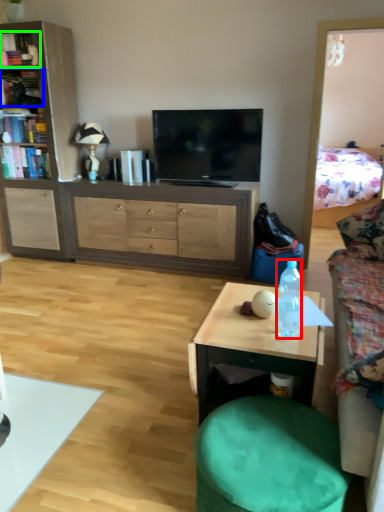
Question: Which is nearer to the bottle (highlighted by a red box)? book (highlighted by a blue box) or book (highlighted by a green box).

Choices:
 (A) book
 (B) book

Answer: (B)